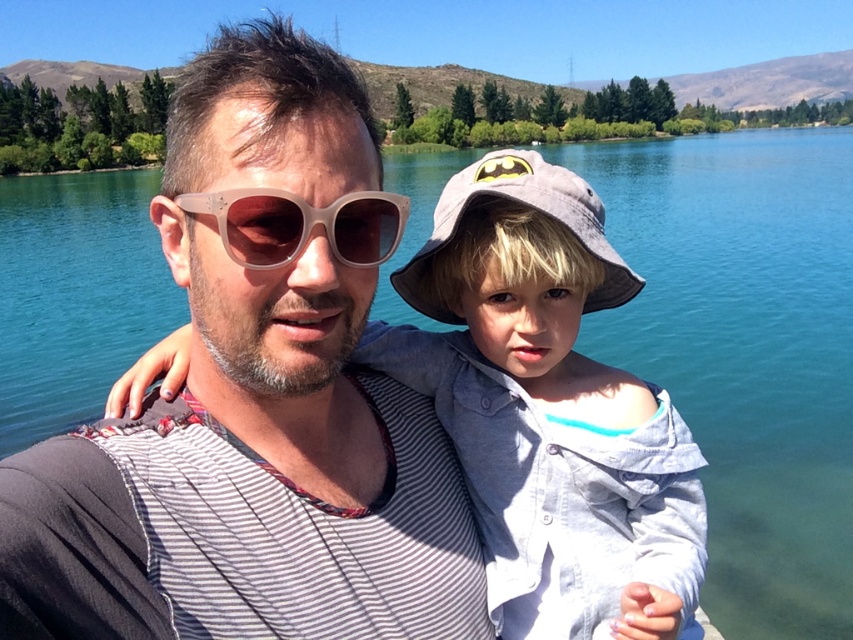
You are trying to determine which clothing item is closer to you in the image. The scene shows two people by a lake. You see the light gray cotton shirt at center and the gray fabric baseball hat at center. Which clothing item is positioned closer to you?

The light gray cotton shirt at center is in front of the gray fabric baseball hat at center, so it is closer to you.

You are a photographer trying to capture a candid shot of the two people in the scene. You want to ensure there is enough space between the gray fabric baseball hat at center and the translucent plastic sunglasses at center so that both are clearly visible in the frame. Given that your camera has a minimum focus distance of 30 inches, will you be able to capture both objects clearly without them overlapping?

The distance between the gray fabric baseball hat at center and the translucent plastic sunglasses at center is 34.06 inches, which exceeds the camera minimum focus distance of 30 inches. Therefore, both objects can be captured clearly without overlapping.